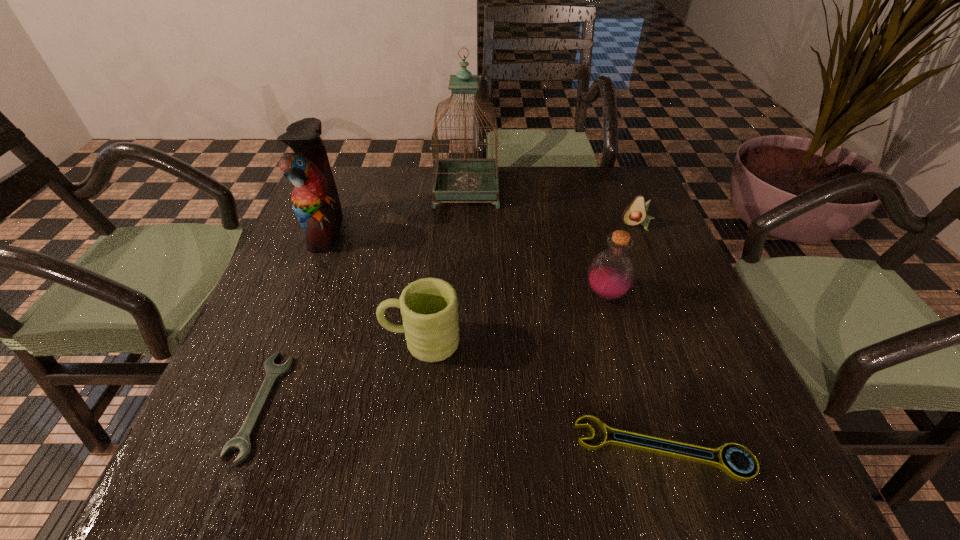
At what (x,y) coordinates should I click in order to perform the action: click on vacant region located on the left of the fifth shortest object. Please return your answer as a coordinate pair (x, y). Looking at the image, I should click on (415, 294).

The width and height of the screenshot is (960, 540). I want to click on vacant space located on the side of the mug with the handle, so click(x=316, y=341).

In order to click on vacant position located 0.270m on the side of the mug with the handle in this screenshot , I will do `click(243, 341)`.

Identify the location of vacant area located 0.160m on the side of the mug with the handle. (300, 341).

Where is `vacant space positioned 0.330m on the seed side of the third shortest object`? This screenshot has width=960, height=540. vacant space positioned 0.330m on the seed side of the third shortest object is located at coordinates (684, 336).

Identify the location of vacant space situated on the left of the right wrench. The height and width of the screenshot is (540, 960). (382, 448).

I want to click on free space located on the back of the left wrench, so click(291, 329).

I want to click on birdcage that is at the far edge, so click(x=454, y=179).

Identify the location of parrot at the far edge. (315, 200).

This screenshot has height=540, width=960. Identify the location of parrot that is at the left edge. (315, 200).